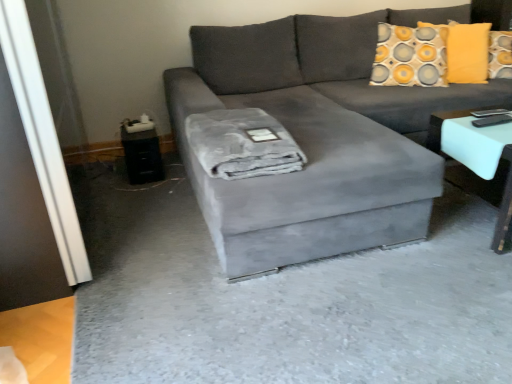
Question: Can you confirm if black plastic side table at lower left is bigger than gray plush blanket at center?

Choices:
 (A) yes
 (B) no

Answer: (B)

Question: Does black plastic side table at lower left come behind gray plush blanket at center?

Choices:
 (A) no
 (B) yes

Answer: (B)

Question: Does black plastic side table at lower left have a smaller size compared to gray plush blanket at center?

Choices:
 (A) yes
 (B) no

Answer: (A)

Question: From the image's perspective, is black plastic side table at lower left located above gray plush blanket at center?

Choices:
 (A) yes
 (B) no

Answer: (A)

Question: Can gray plush blanket at center be found inside black plastic side table at lower left?

Choices:
 (A) yes
 (B) no

Answer: (B)

Question: Does black plastic side table at lower left have a lesser width compared to gray plush blanket at center?

Choices:
 (A) yes
 (B) no

Answer: (A)

Question: Considering the relative sizes of white glossy table at right and black plastic side table at lower left in the image provided, is white glossy table at right bigger than black plastic side table at lower left?

Choices:
 (A) yes
 (B) no

Answer: (A)

Question: Can you confirm if white glossy table at right is taller than black plastic side table at lower left?

Choices:
 (A) yes
 (B) no

Answer: (A)

Question: From a real-world perspective, is white glossy table at right located higher than black plastic side table at lower left?

Choices:
 (A) no
 (B) yes

Answer: (B)

Question: Is white glossy table at right oriented away from black plastic side table at lower left?

Choices:
 (A) yes
 (B) no

Answer: (B)

Question: From the image's perspective, does white glossy table at right appear lower than black plastic side table at lower left?

Choices:
 (A) no
 (B) yes

Answer: (B)

Question: Can we say white glossy table at right lies outside black plastic side table at lower left?

Choices:
 (A) yes
 (B) no

Answer: (A)

Question: Is transparent glass door at left not inside gray plush blanket at center?

Choices:
 (A) no
 (B) yes

Answer: (B)